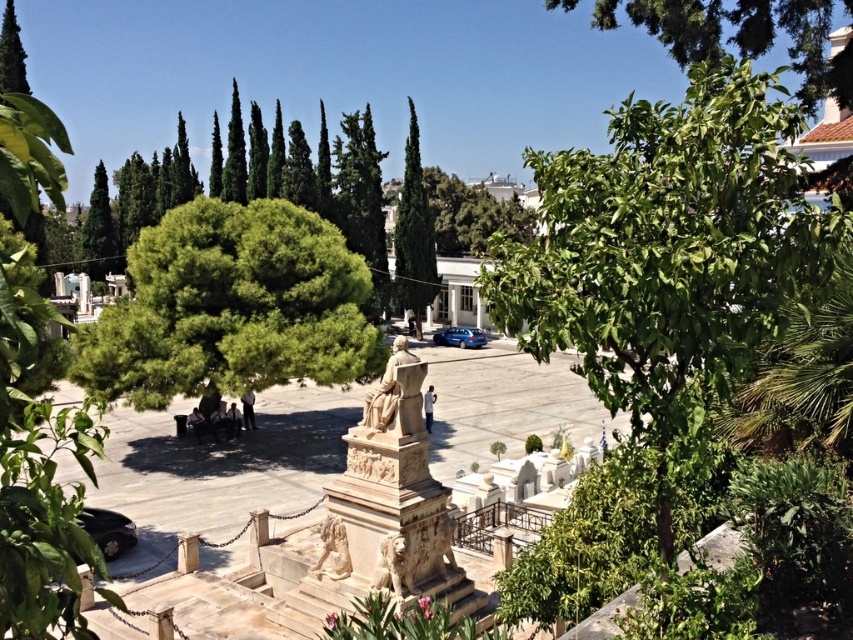
Question: Among these points, which one is nearest to the camera?

Choices:
 (A) (624, 204)
 (B) (387, 420)
 (C) (473, 344)

Answer: (A)

Question: Where is green leafy tree at upper center located in relation to green textured tree at center in the image?

Choices:
 (A) left
 (B) right

Answer: (B)

Question: Does green leafy tree at center appear on the left side of green leafy tree at upper center?

Choices:
 (A) no
 (B) yes

Answer: (B)

Question: Is beige stone statue at center positioned at the back of marble lion at center?

Choices:
 (A) no
 (B) yes

Answer: (B)

Question: Which point appears closest to the camera in this image?

Choices:
 (A) (395, 573)
 (B) (364, 408)
 (C) (733, 36)

Answer: (A)

Question: Which point is closer to the camera?

Choices:
 (A) green leafy tree at center
 (B) green leafy tree at upper right
 (C) green leafy tree at upper center
 (D) beige stone statue at center

Answer: (B)